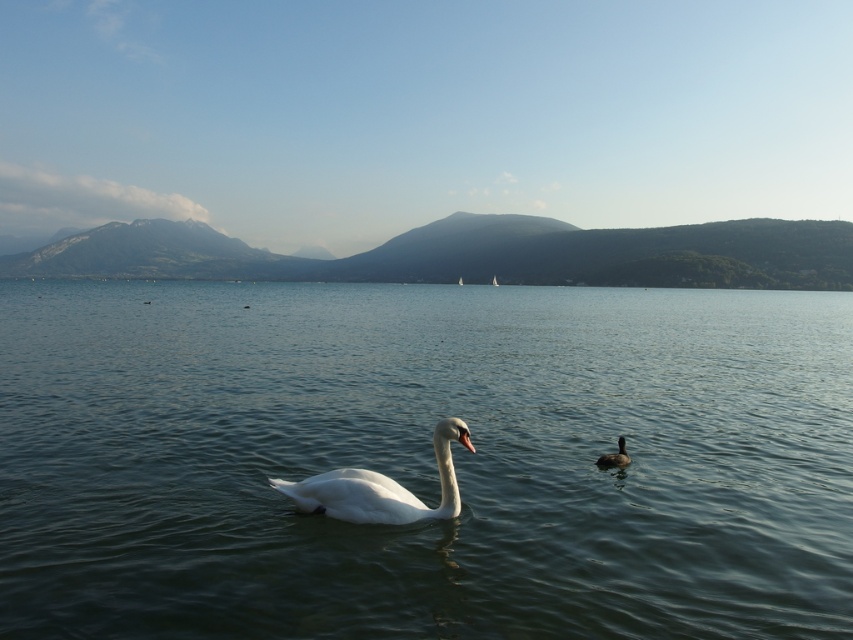
The image size is (853, 640). In order to click on clear water at center in this screenshot , I will do `click(422, 460)`.

Locate an element on the screen. The height and width of the screenshot is (640, 853). clear water at center is located at coordinates (422, 460).

Is point (381, 477) farther from camera compared to point (601, 465)?

No.

Locate an element on the screen. The height and width of the screenshot is (640, 853). white glossy swan at center is located at coordinates tap(380, 486).

Can you confirm if clear water at center is positioned to the right of dark brown glossy duck at right?

Correct, you'll find clear water at center to the right of dark brown glossy duck at right.

Does clear water at center appear under dark brown glossy duck at right?

Actually, clear water at center is above dark brown glossy duck at right.

Locate an element on the screen. clear water at center is located at coordinates (422, 460).